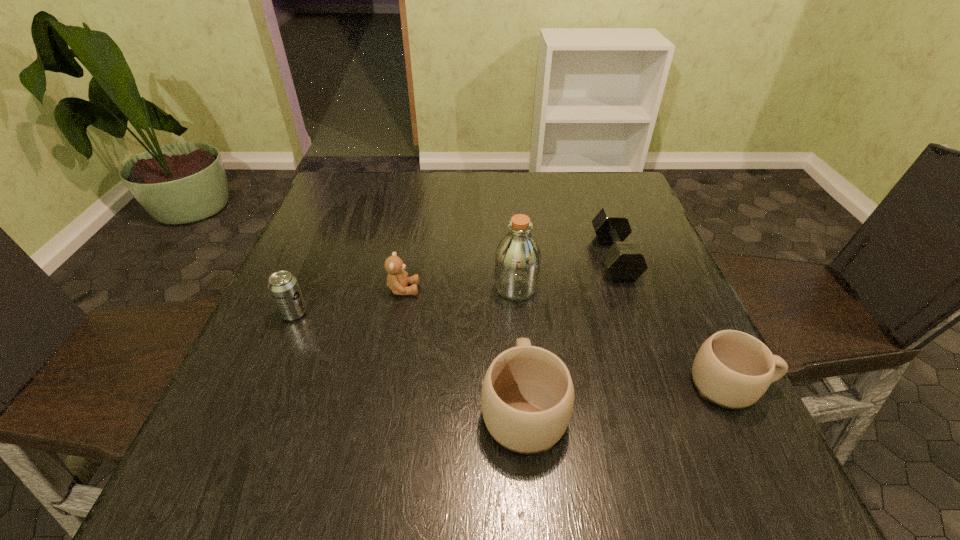
Image resolution: width=960 pixels, height=540 pixels. What are the coordinates of `free space at the left edge of the desktop` in the screenshot? It's located at (328, 227).

Where is `free space at the right edge of the desktop`? Image resolution: width=960 pixels, height=540 pixels. free space at the right edge of the desktop is located at coordinates (642, 370).

Locate an element on the screen. The height and width of the screenshot is (540, 960). vacant space at the far left corner of the desktop is located at coordinates (381, 173).

At what (x,y) coordinates should I click in order to perform the action: click on free space between the teddy bear and the bottle. Please return your answer as a coordinate pair (x, y). Looking at the image, I should click on (460, 288).

I want to click on free spot between the rightmost object and the dumbbell, so click(673, 321).

You are a GUI agent. You are given a task and a screenshot of the screen. Output one action in this format:
    pyautogui.click(x=<x>, y=<y>)
    Task: Click on the free space between the beer can and the fifth object from left to right
    This screenshot has height=540, width=960.
    Given the screenshot: What is the action you would take?
    pyautogui.click(x=454, y=285)

Image resolution: width=960 pixels, height=540 pixels. Find the location of `empty space that is in between the dumbbell and the leftmost object`. empty space that is in between the dumbbell and the leftmost object is located at coordinates (454, 285).

Find the location of a particular element. Image resolution: width=960 pixels, height=540 pixels. free spot between the taller mug and the second object from left to right is located at coordinates (464, 348).

The height and width of the screenshot is (540, 960). What are the coordinates of `free space between the fifth object from right to left and the left mug` in the screenshot? It's located at (464, 348).

Locate an element on the screen. empty location between the shorter mug and the fifth object from left to right is located at coordinates (673, 321).